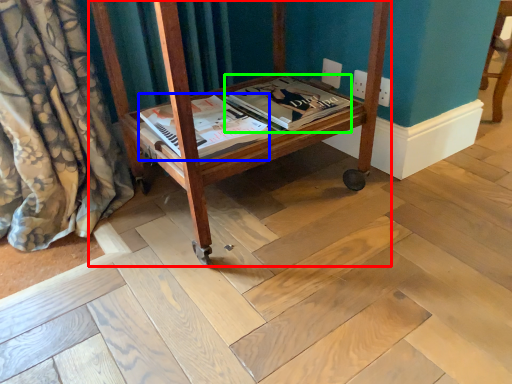
Question: Which is farther away from furniture (highlighted by a red box)? magazine (highlighted by a blue box) or magazine (highlighted by a green box)?

Choices:
 (A) magazine
 (B) magazine

Answer: (B)